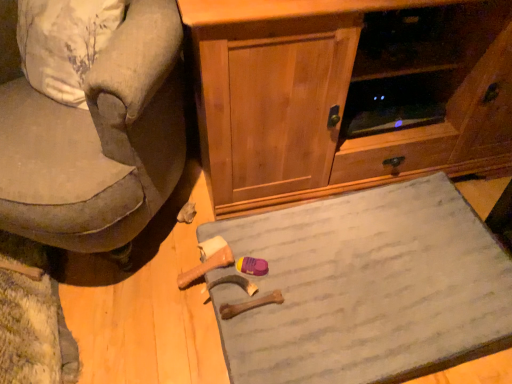
Question: From a real-world perspective, does gray fabric doormat at lower center sit lower than wooden cabinet at center?

Choices:
 (A) no
 (B) yes

Answer: (B)

Question: Is gray fabric doormat at lower center wider than wooden cabinet at center?

Choices:
 (A) yes
 (B) no

Answer: (B)

Question: Considering the relative sizes of gray fabric doormat at lower center and wooden cabinet at center in the image provided, is gray fabric doormat at lower center taller than wooden cabinet at center?

Choices:
 (A) yes
 (B) no

Answer: (B)

Question: From a real-world perspective, is gray fabric doormat at lower center over wooden cabinet at center?

Choices:
 (A) yes
 (B) no

Answer: (B)

Question: Is gray fabric doormat at lower center in contact with wooden cabinet at center?

Choices:
 (A) yes
 (B) no

Answer: (B)

Question: Is point (328, 180) closer or farther from the camera than point (131, 9)?

Choices:
 (A) closer
 (B) farther

Answer: (B)

Question: Considering their positions, is wooden cabinet at center located in front of or behind velvet gray armchair at left?

Choices:
 (A) front
 (B) behind

Answer: (B)

Question: Is wooden cabinet at center bigger or smaller than velvet gray armchair at left?

Choices:
 (A) small
 (B) big

Answer: (B)

Question: From a real-world perspective, is wooden cabinet at center positioned above or below velvet gray armchair at left?

Choices:
 (A) above
 (B) below

Answer: (A)

Question: Considering the positions of gray fabric doormat at lower center and wooden cabinet at center in the image, is gray fabric doormat at lower center bigger or smaller than wooden cabinet at center?

Choices:
 (A) big
 (B) small

Answer: (B)

Question: From the image's perspective, is gray fabric doormat at lower center located above or below wooden cabinet at center?

Choices:
 (A) above
 (B) below

Answer: (B)

Question: Is gray fabric doormat at lower center inside the boundaries of wooden cabinet at center, or outside?

Choices:
 (A) inside
 (B) outside

Answer: (B)

Question: From a real-world perspective, is gray fabric doormat at lower center physically located above or below wooden cabinet at center?

Choices:
 (A) below
 (B) above

Answer: (A)

Question: In the image, is gray fabric doormat at lower center positioned in front of or behind velvet gray armchair at left?

Choices:
 (A) behind
 (B) front

Answer: (A)

Question: Is gray fabric doormat at lower center situated inside velvet gray armchair at left or outside?

Choices:
 (A) inside
 (B) outside

Answer: (B)